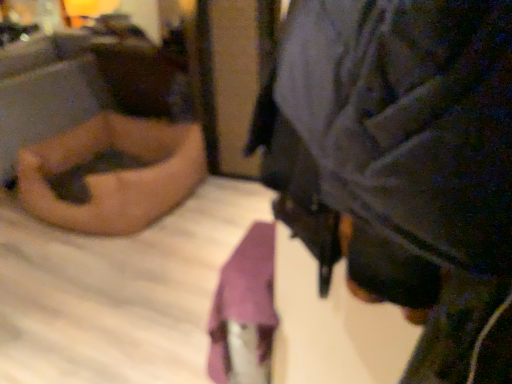
Question: Can you confirm if matte black laptop at left, the second person positioned from the right, is thinner than velvet-like black jacket at center, which is the 1th person in right-to-left order?

Choices:
 (A) no
 (B) yes

Answer: (A)

Question: From a real-world perspective, is matte black laptop at left, marked as the second person in a front-to-back arrangement, below velvet-like black jacket at center, acting as the 1th person starting from the front?

Choices:
 (A) yes
 (B) no

Answer: (A)

Question: Would you say matte black laptop at left, positioned as the 1th person in back-to-front order, is outside velvet-like black jacket at center, placed as the 2th person when sorted from left to right?

Choices:
 (A) yes
 (B) no

Answer: (A)

Question: Is matte black laptop at left, positioned as the 1th person in back-to-front order, oriented away from velvet-like black jacket at center, which is the 1th person in right-to-left order?

Choices:
 (A) no
 (B) yes

Answer: (B)

Question: Would you say matte black laptop at left, positioned as the 1th person in back-to-front order, contains velvet-like black jacket at center, which appears as the second person when viewed from the back?

Choices:
 (A) yes
 (B) no

Answer: (B)

Question: Can you confirm if matte black laptop at left, the second person positioned from the right, is taller than velvet-like black jacket at center, which is the 1th person in right-to-left order?

Choices:
 (A) yes
 (B) no

Answer: (A)

Question: Is velvet-like black jacket at center, which appears as the second person when viewed from the back, behind matte black laptop at left, the 1th person when ordered from left to right?

Choices:
 (A) yes
 (B) no

Answer: (B)

Question: Could you tell me if velvet-like black jacket at center, which appears as the second person when viewed from the back, is facing matte black laptop at left, the second person positioned from the right?

Choices:
 (A) no
 (B) yes

Answer: (A)

Question: Is matte black laptop at left, positioned as the 1th person in back-to-front order, inside velvet-like black jacket at center, acting as the 1th person starting from the front?

Choices:
 (A) yes
 (B) no

Answer: (B)

Question: From the image's perspective, is velvet-like black jacket at center, acting as the 1th person starting from the front, under matte black laptop at left, the 1th person when ordered from left to right?

Choices:
 (A) yes
 (B) no

Answer: (A)

Question: Can you confirm if velvet-like black jacket at center, which appears as the second person when viewed from the back, is smaller than matte black laptop at left, the 1th person when ordered from left to right?

Choices:
 (A) no
 (B) yes

Answer: (B)

Question: Does velvet-like black jacket at center, placed as the 2th person when sorted from left to right, lie in front of matte black laptop at left, marked as the second person in a front-to-back arrangement?

Choices:
 (A) yes
 (B) no

Answer: (A)

Question: From the image's perspective, is velvet-like black jacket at center, which appears as the second person when viewed from the back, located above or below matte black laptop at left, the 1th person when ordered from left to right?

Choices:
 (A) below
 (B) above

Answer: (A)